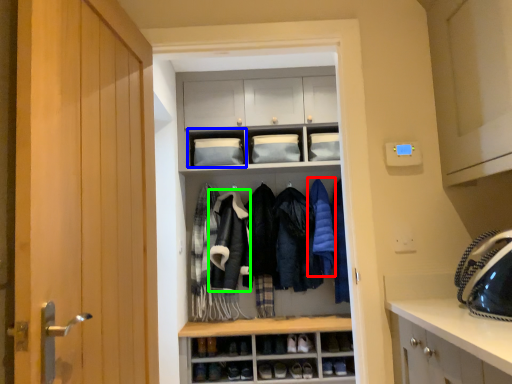
Question: Considering the real-world distances, which object is closest to clothing (highlighted by a red box)? cabinet (highlighted by a blue box) or sweatshirt (highlighted by a green box).

Choices:
 (A) cabinet
 (B) sweatshirt

Answer: (B)